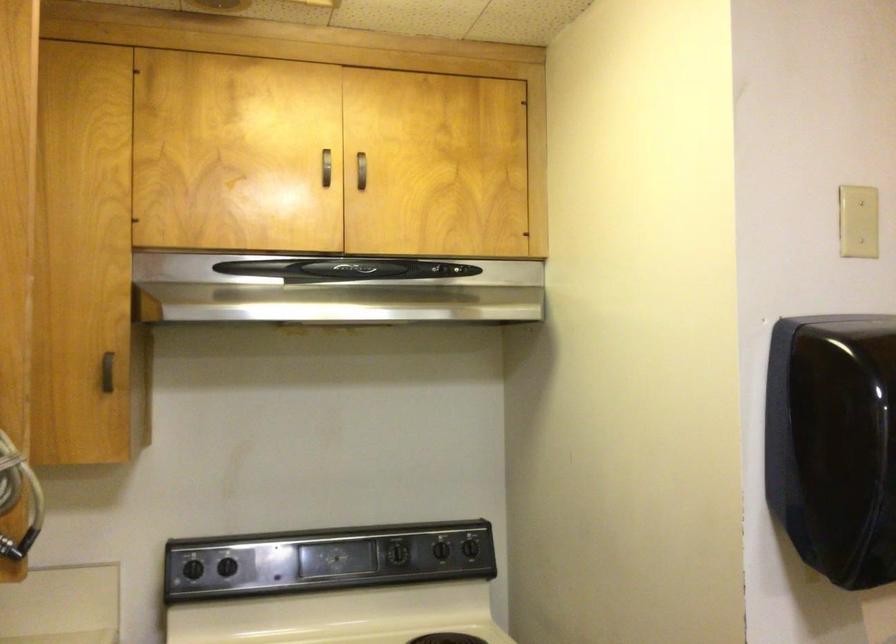
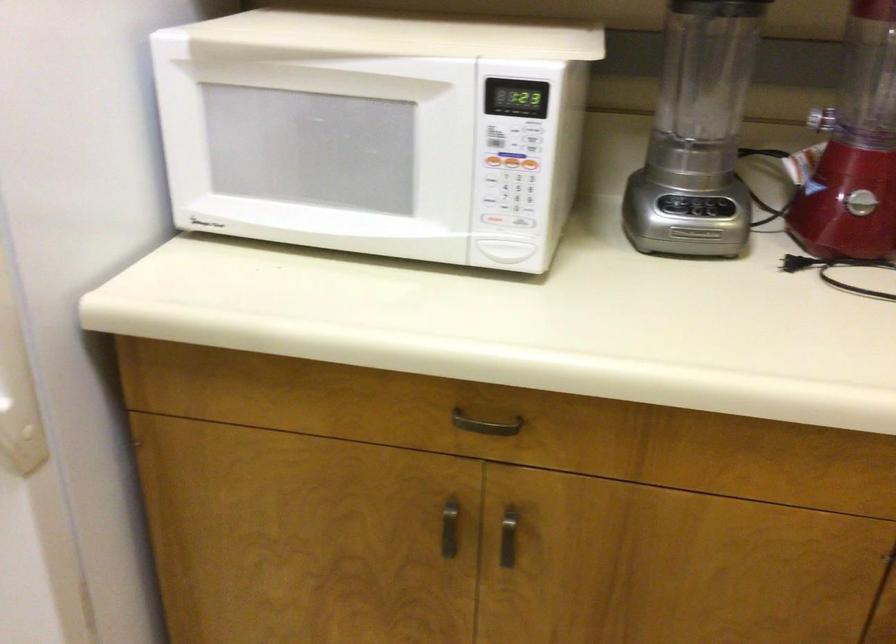
Based on the continuous images, in which direction is the camera rotating?

The camera's rotation is toward left-down.